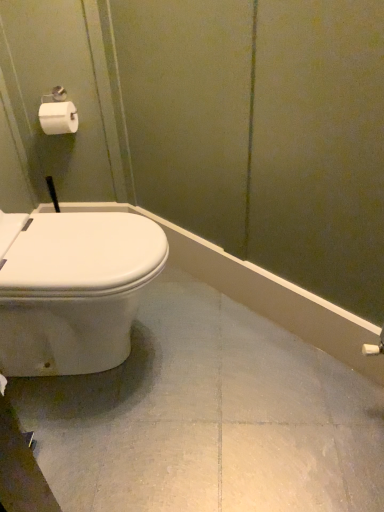
The height and width of the screenshot is (512, 384). Describe the element at coordinates (75, 291) in the screenshot. I see `white glossy toilet at left` at that location.

At what (x,y) coordinates should I click in order to perform the action: click on white glossy toilet at left. Please return your answer as a coordinate pair (x, y). Looking at the image, I should click on (75, 291).

Identify the location of white matte toilet paper at upper left. This screenshot has height=512, width=384. (58, 118).

What is the approximate height of white matte toilet paper at upper left?

white matte toilet paper at upper left is 4.20 inches in height.

The width and height of the screenshot is (384, 512). What do you see at coordinates (58, 118) in the screenshot? I see `white matte toilet paper at upper left` at bounding box center [58, 118].

I want to click on white glossy toilet at left, so click(75, 291).

Looking at this image, does white glossy toilet at left appear on the right side of white matte toilet paper at upper left?

Indeed, white glossy toilet at left is positioned on the right side of white matte toilet paper at upper left.

Based on the photo, does white glossy toilet at left come behind white matte toilet paper at upper left?

No, the depth of white glossy toilet at left is less than that of white matte toilet paper at upper left.

Which is in front, point (105, 213) or point (62, 120)?

The point (105, 213) is closer to the camera.

From the image's perspective, which is below, white glossy toilet at left or white matte toilet paper at upper left?

white glossy toilet at left, from the image's perspective.

From a real-world perspective, is white glossy toilet at left beneath white matte toilet paper at upper left?

Yes.

Considering the sizes of white glossy toilet at left and white matte toilet paper at upper left in the image, is white glossy toilet at left wider or thinner than white matte toilet paper at upper left?

Clearly, white glossy toilet at left has more width compared to white matte toilet paper at upper left.

Does white glossy toilet at left have a greater height compared to white matte toilet paper at upper left?

Correct, white glossy toilet at left is much taller as white matte toilet paper at upper left.

Is white glossy toilet at left bigger than white matte toilet paper at upper left?

Correct, white glossy toilet at left is larger in size than white matte toilet paper at upper left.

Is white glossy toilet at left situated inside white matte toilet paper at upper left or outside?

white glossy toilet at left is located beyond the bounds of white matte toilet paper at upper left.

Is white glossy toilet at left placed right next to white matte toilet paper at upper left?

No, white glossy toilet at left is not next to white matte toilet paper at upper left.

Is white glossy toilet at left facing towards white matte toilet paper at upper left?

No, white glossy toilet at left is not oriented towards white matte toilet paper at upper left.

Looking at this image, can you tell me how much white glossy toilet at left and white matte toilet paper at upper left differ in facing direction?

They differ by 89.5 degrees in their facing directions.

The height and width of the screenshot is (512, 384). I want to click on toilet paper on the left side of white glossy toilet at left, so click(58, 118).

Based on their positions, is white matte toilet paper at upper left located to the left or right of white glossy toilet at left?

In the image, white matte toilet paper at upper left appears on the left side of white glossy toilet at left.

Is the depth of white matte toilet paper at upper left less than that of white glossy toilet at left?

No, it is behind white glossy toilet at left.

Between point (53, 112) and point (17, 281), which one is positioned in front?

The point (17, 281) is closer to the camera.

From the image's perspective, between white matte toilet paper at upper left and white glossy toilet at left, who is located below?

white glossy toilet at left.

In the scene shown: From a real-world perspective, is white matte toilet paper at upper left physically below white glossy toilet at left?

No, from a real-world perspective, white matte toilet paper at upper left is not under white glossy toilet at left.

Is white matte toilet paper at upper left wider or thinner than white glossy toilet at left?

white matte toilet paper at upper left is thinner than white glossy toilet at left.

Is white matte toilet paper at upper left shorter than white glossy toilet at left?

Yes, white matte toilet paper at upper left is shorter than white glossy toilet at left.

Which of these two, white matte toilet paper at upper left or white glossy toilet at left, is bigger?

With larger size is white glossy toilet at left.

Is white glossy toilet at left a part of white matte toilet paper at upper left?

No, white glossy toilet at left is not inside white matte toilet paper at upper left.

Would you consider white matte toilet paper at upper left to be distant from white glossy toilet at left?

No, there isn't a large distance between white matte toilet paper at upper left and white glossy toilet at left.

Is white matte toilet paper at upper left looking in the opposite direction of white glossy toilet at left?

white matte toilet paper at upper left does not have its back to white glossy toilet at left.

Find the location of a particular element. toilet below the white matte toilet paper at upper left (from the image's perspective) is located at coordinates (75, 291).

Image resolution: width=384 pixels, height=512 pixels. I want to click on toilet located below the white matte toilet paper at upper left (from the image's perspective), so click(x=75, y=291).

Identify the location of toilet paper above the white glossy toilet at left (from the image's perspective). This screenshot has height=512, width=384. (58, 118).